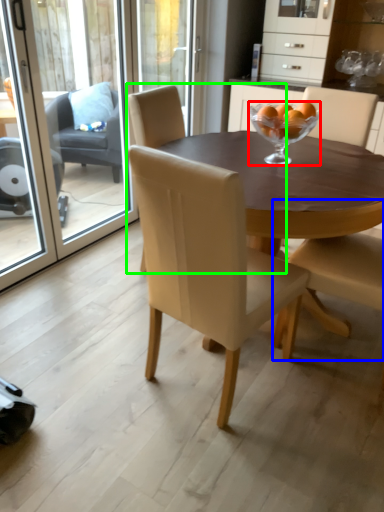
Question: Which is nearer to the martini glass (highlighted by a red box)? chair (highlighted by a blue box) or chair (highlighted by a green box).

Choices:
 (A) chair
 (B) chair

Answer: (A)